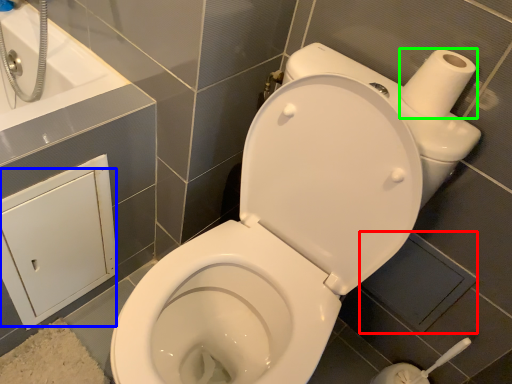
Question: Considering the real-world distances, which object is closest to square (highlighted by a red box)? screen door (highlighted by a blue box) or toilet paper (highlighted by a green box).

Choices:
 (A) screen door
 (B) toilet paper

Answer: (B)